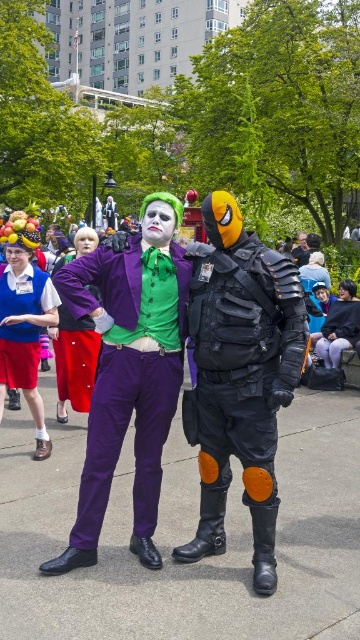
Can you confirm if matte black tactical vest at center is positioned to the right of matte blue vest at center?

Yes, matte black tactical vest at center is to the right of matte blue vest at center.

Can you confirm if matte black tactical vest at center is positioned below matte blue vest at center?

Yes.

The height and width of the screenshot is (640, 360). Describe the element at coordinates (240, 376) in the screenshot. I see `matte black tactical vest at center` at that location.

Where is `matte black tactical vest at center`? matte black tactical vest at center is located at coordinates (240, 376).

Based on the photo, can you confirm if matte blue vest at left is shorter than matte blue vest at center?

Correct, matte blue vest at left is not as tall as matte blue vest at center.

Is point (33, 218) farther from camera compared to point (37, 330)?

Yes, point (33, 218) is farther from viewer.

Is point (32, 372) farther from viewer compared to point (1, 324)?

Yes, it is.

Image resolution: width=360 pixels, height=640 pixels. Find the location of `matte blue vest at left`. matte blue vest at left is located at coordinates (24, 317).

Can you confirm if purple matte pants at center is positioned above matte blue vest at center?

Actually, purple matte pants at center is below matte blue vest at center.

Which is more to the right, purple matte pants at center or matte blue vest at center?

purple matte pants at center

You are a GUI agent. You are given a task and a screenshot of the screen. Output one action in this format:
    pyautogui.click(x=<x>, y=<y>)
    Task: Click on the purple matte pants at center
    This screenshot has width=360, height=640.
    Given the screenshot: What is the action you would take?
    pyautogui.click(x=128, y=420)